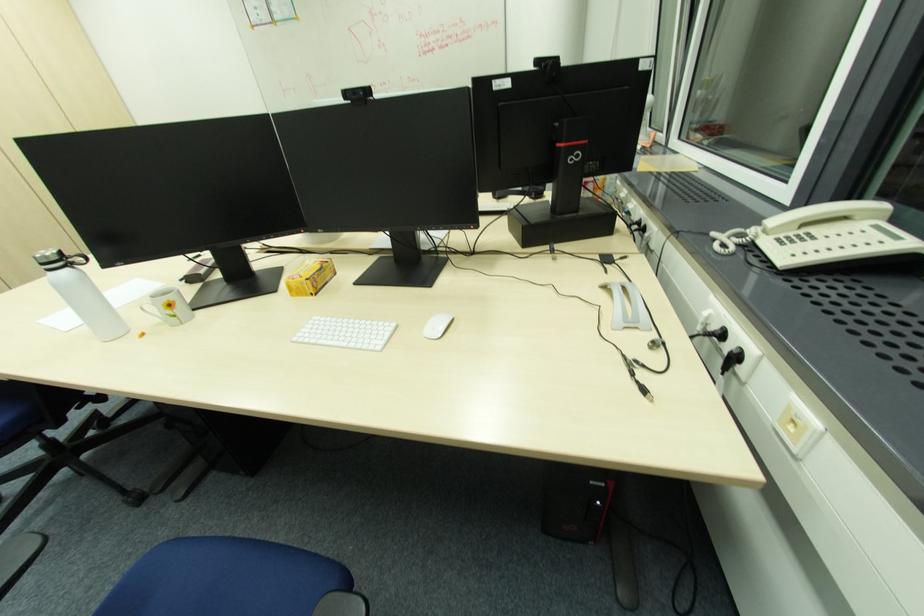
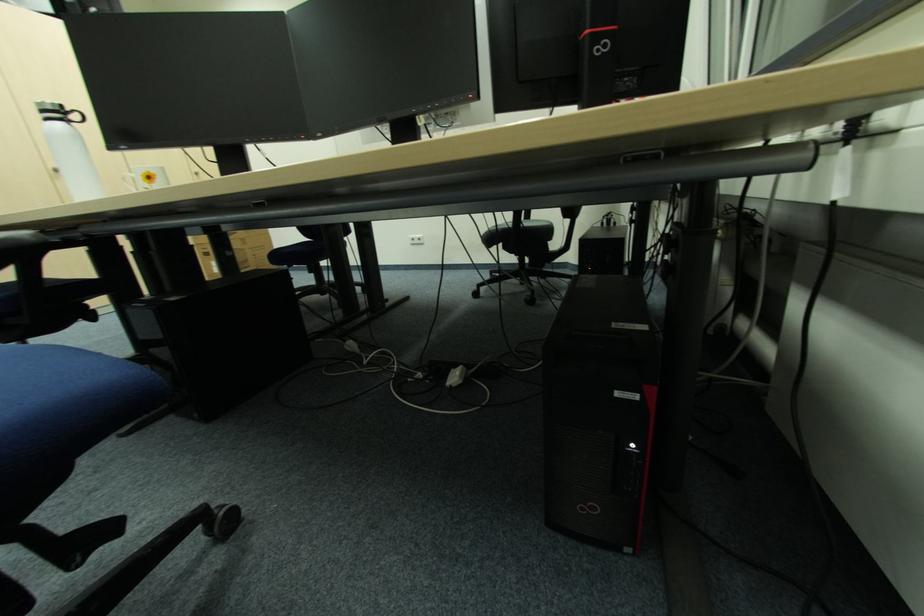
Question: The images are taken continuously from a first-person perspective. In which direction is your viewpoint rotating?

Choices:
 (A) Left
 (B) Right
 (C) Up
 (D) Down

Answer: (C)